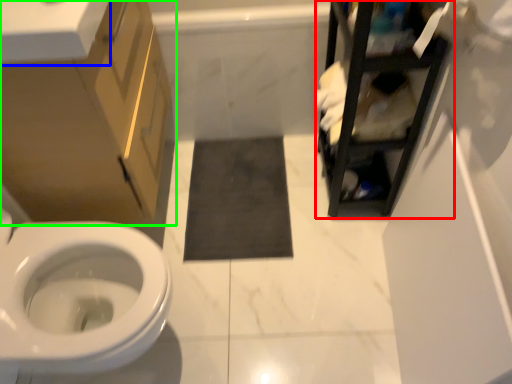
Question: Which object is the farthest from cabinetry (highlighted by a red box)? Choose among these: counter top (highlighted by a blue box) or bathroom cabinet (highlighted by a green box).

Choices:
 (A) counter top
 (B) bathroom cabinet

Answer: (A)